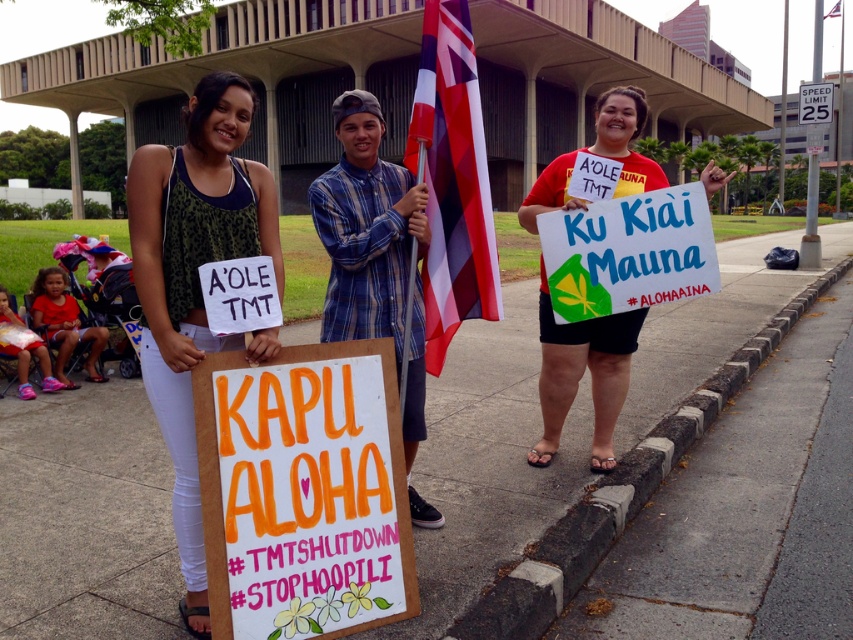
Question: Which object appears closest to the camera in this image?

Choices:
 (A) blue plaid shirt at center
 (B) red matte sign at center

Answer: (A)

Question: Is cheetah print tank top at center smaller than red fabric flag at center?

Choices:
 (A) yes
 (B) no

Answer: (B)

Question: Which object is closer to the camera taking this photo?

Choices:
 (A) blue plaid shirt at center
 (B) gray concrete curb at lower right

Answer: (B)

Question: Is cheetah print tank top at center in front of gray concrete curb at lower right?

Choices:
 (A) no
 (B) yes

Answer: (B)

Question: From the image, what is the correct spatial relationship of white concrete pavement at lower center in relation to red fabric flag at center?

Choices:
 (A) left
 (B) right

Answer: (B)

Question: Which of these objects is positioned farthest from the cheetah print tank top at center?

Choices:
 (A) hand-painted cardboard sign at center
 (B) blue plaid shirt at center

Answer: (B)